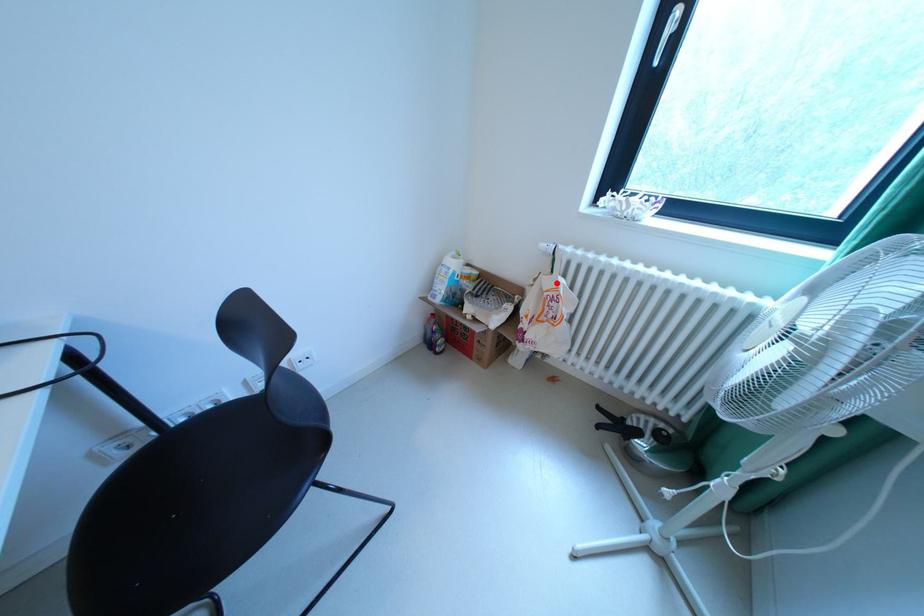
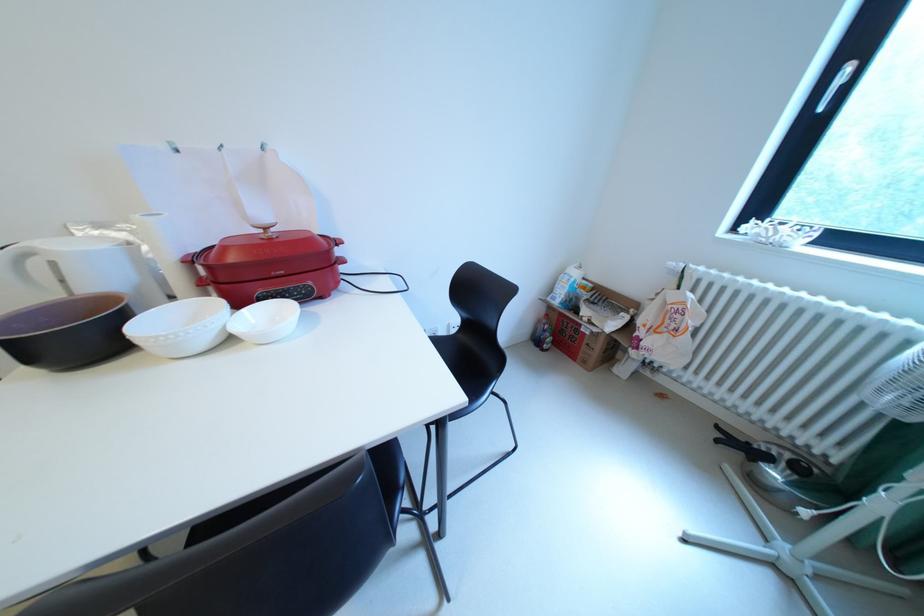
The point at the highlighted location is marked in the first image. Where is the corresponding point in the second image?

(682, 297)